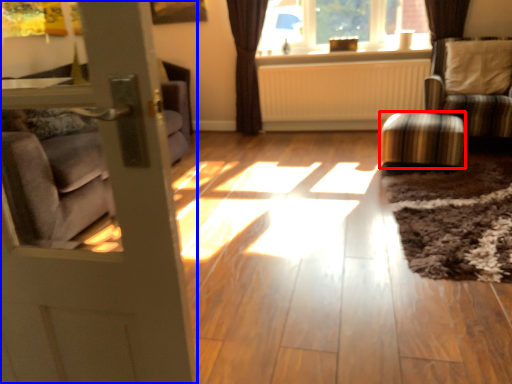
Question: Which object is closer to the camera taking this photo, stool (highlighted by a red box) or door (highlighted by a blue box)?

Choices:
 (A) stool
 (B) door

Answer: (B)